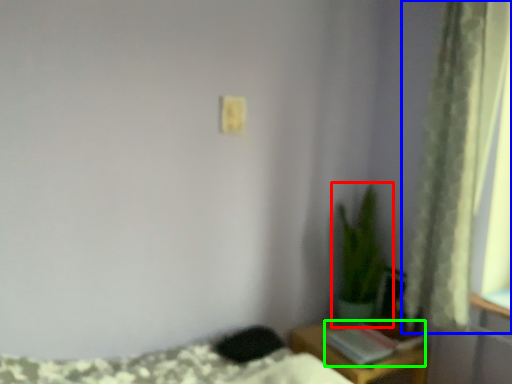
Question: Considering the real-world distances, which object is farthest from houseplant (highlighted by a red box)? curtain (highlighted by a blue box) or book (highlighted by a green box)?

Choices:
 (A) curtain
 (B) book

Answer: (A)